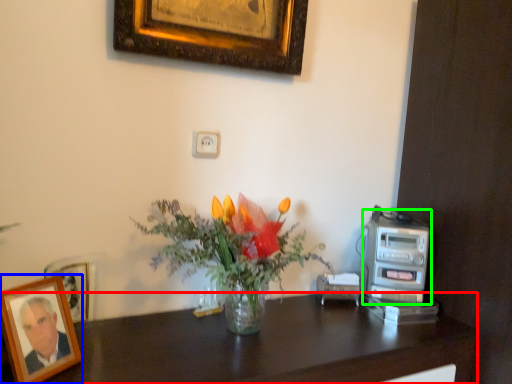
Question: Which is nearer to the desk (highlighted by a red box)? picture frame (highlighted by a blue box) or appliance (highlighted by a green box).

Choices:
 (A) picture frame
 (B) appliance

Answer: (B)